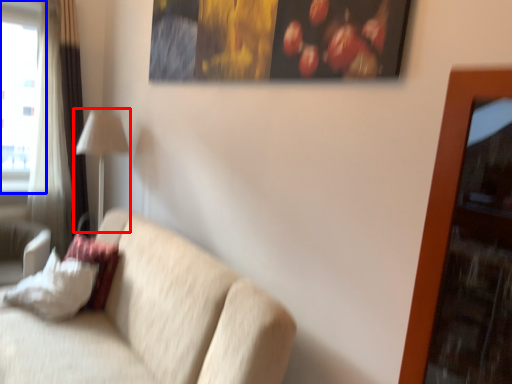
Question: Which object is further to the camera taking this photo, table lamp (highlighted by a red box) or window (highlighted by a blue box)?

Choices:
 (A) table lamp
 (B) window

Answer: (B)